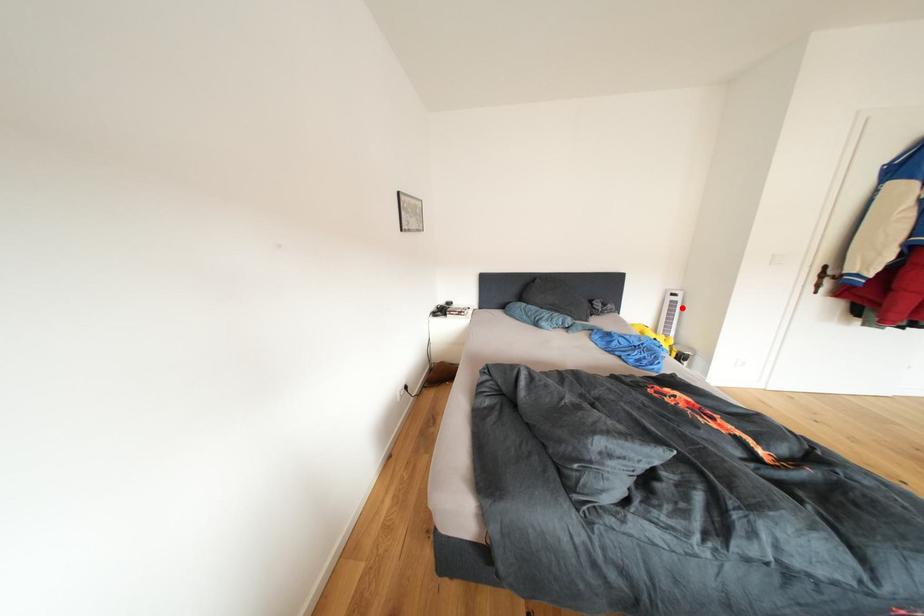
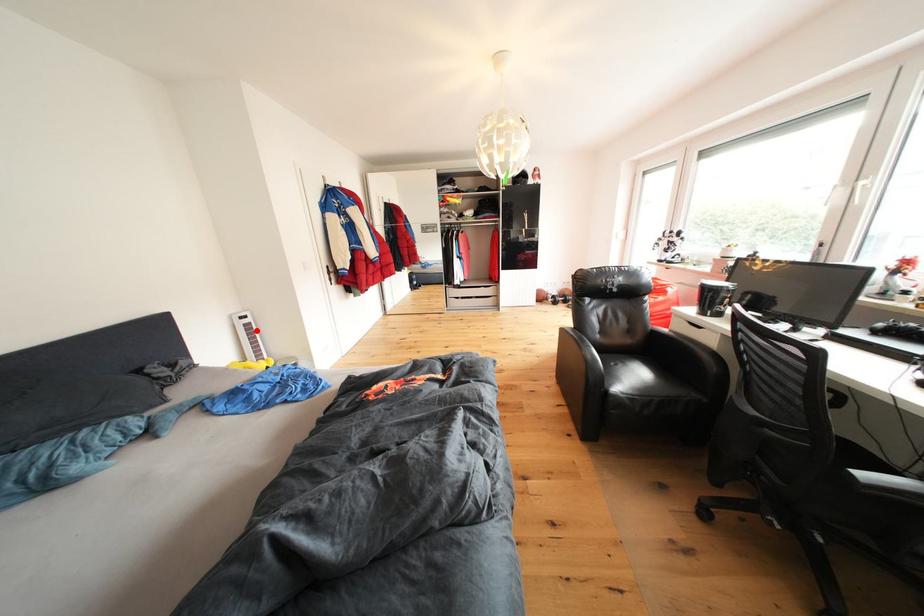
I am providing you with two images of the same scene from different viewpoints. A red point is marked on the first image and another point is marked on the second image. Does the point marked in image1 correspond to the same location as the one in image2?

Yes